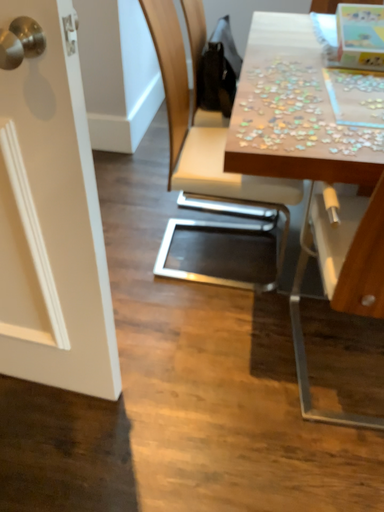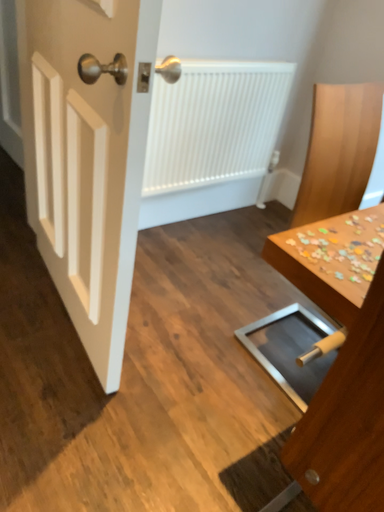
Question: Which way did the camera rotate in the video?

Choices:
 (A) rotated right
 (B) rotated left

Answer: (B)